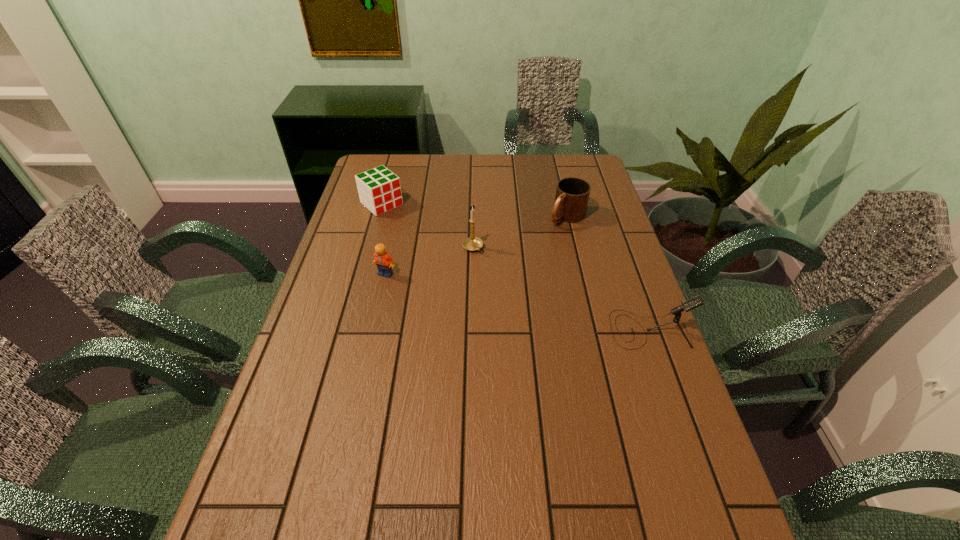
What are the coordinates of `cube present at the left edge` in the screenshot? It's located at (379, 189).

Locate an element on the screen. This screenshot has width=960, height=540. microphone located at the right edge is located at coordinates (690, 304).

Locate an element on the screen. mug positioned at the right edge is located at coordinates (572, 194).

Where is `vacant region at the far edge of the desktop`? This screenshot has height=540, width=960. vacant region at the far edge of the desktop is located at coordinates (498, 179).

This screenshot has width=960, height=540. Find the location of `free space at the near edge of the desktop`. free space at the near edge of the desktop is located at coordinates (408, 478).

Where is `free space at the left edge`? free space at the left edge is located at coordinates (340, 341).

This screenshot has height=540, width=960. In the image, there is a desktop. Identify the location of vacant area at the right edge. (632, 298).

The image size is (960, 540). In order to click on vacant area at the far left corner in this screenshot , I will do `click(367, 157)`.

Identify the location of vacant space at the far right corner of the desktop. The image size is (960, 540). (593, 186).

Image resolution: width=960 pixels, height=540 pixels. I want to click on free space between the cube and the tallest object, so click(x=427, y=226).